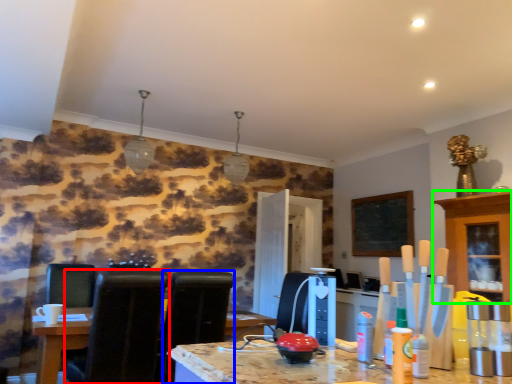
Question: Estimate the real-world distances between objects in this image. Which object is farther from chair (highlighted by a red box), chair (highlighted by a blue box) or cabinetry (highlighted by a green box)?

Choices:
 (A) chair
 (B) cabinetry

Answer: (B)